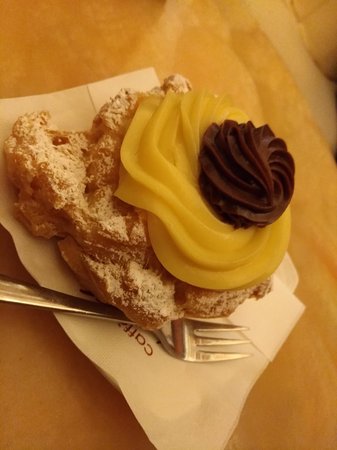
I want to click on end of napkin, so click(x=304, y=308).